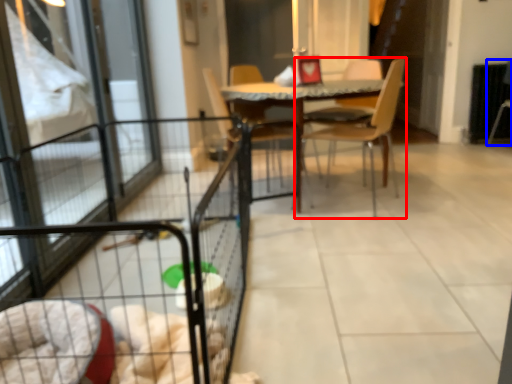
Question: Which object is further to the camera taking this photo, chair (highlighted by a red box) or armchair (highlighted by a blue box)?

Choices:
 (A) chair
 (B) armchair

Answer: (B)